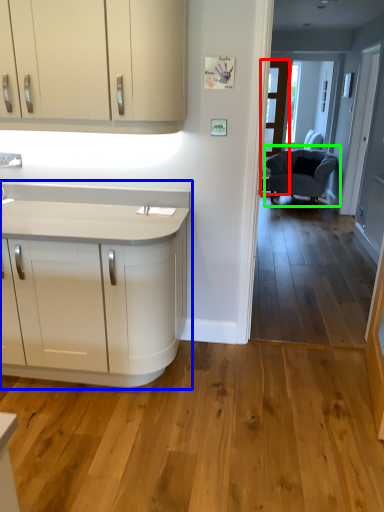
Question: Based on their relative distances, which object is farther from glass door (highlighted by a red box)? Choose from countertop (highlighted by a blue box) and chair (highlighted by a green box).

Choices:
 (A) countertop
 (B) chair

Answer: (A)